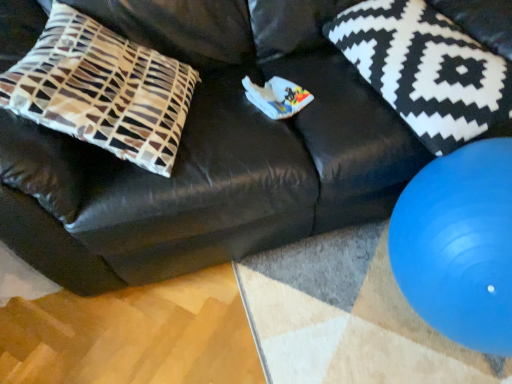
Question: Is brown and white patterned pillow at left, the 2th pillow from the right, inside the boundaries of blue rubber ball at lower right, or outside?

Choices:
 (A) inside
 (B) outside

Answer: (B)

Question: Does point (139, 147) appear closer or farther from the camera than point (441, 259)?

Choices:
 (A) farther
 (B) closer

Answer: (A)

Question: Which is farther from the brown and white patterned pillow at left, which ranks as the 1th pillow in left-to-right order?

Choices:
 (A) blue rubber ball at lower right
 (B) black and white patterned pillow at upper right, the 2th pillow positioned from the left

Answer: (A)

Question: Estimate the real-world distances between objects in this image. Which object is farther from the blue rubber ball at lower right?

Choices:
 (A) black and white patterned pillow at upper right, the 2th pillow positioned from the left
 (B) brown and white patterned pillow at left, which ranks as the 1th pillow in left-to-right order

Answer: (B)